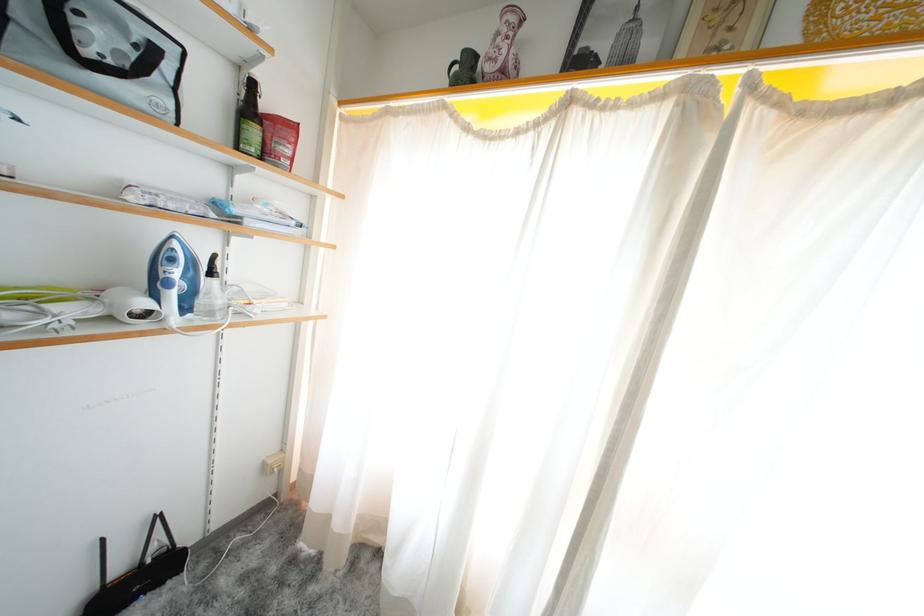
Image resolution: width=924 pixels, height=616 pixels. Identify the location of blue iron handle. (169, 249).